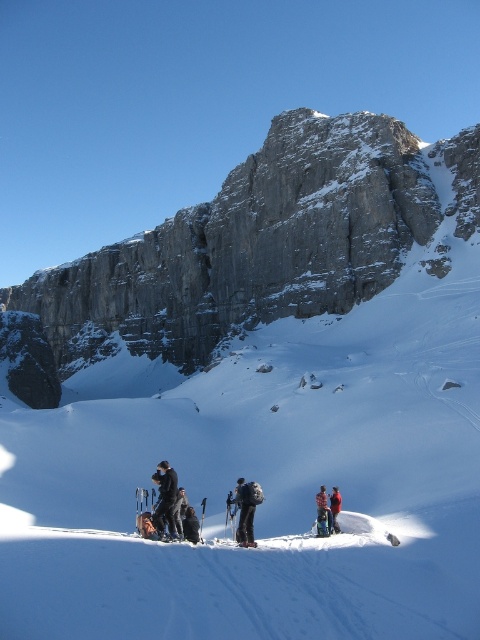
You are a photographer planning to take a group photo of the black fabric jacket at lower center and the black ski suit at center. If you want both subjects to appear the same size in the photo, what adjustment should you make?

To make the black fabric jacket at lower center and the black ski suit at center appear the same size in the photo, you should move the camera closer to the black ski suit at center since it is smaller than the black fabric jacket at lower center.

You are a photographer trying to capture a photo of both the black fabric jacket at lower center and the plaid wool jacket at lower center in the same frame. Since you want both jackets to appear clearly, which jacket should you focus on first to ensure proper focus?

You should focus on the black fabric jacket at lower center first because it is much taller than the plaid wool jacket at lower center, ensuring that the larger subject is in focus before adjusting for the smaller one.